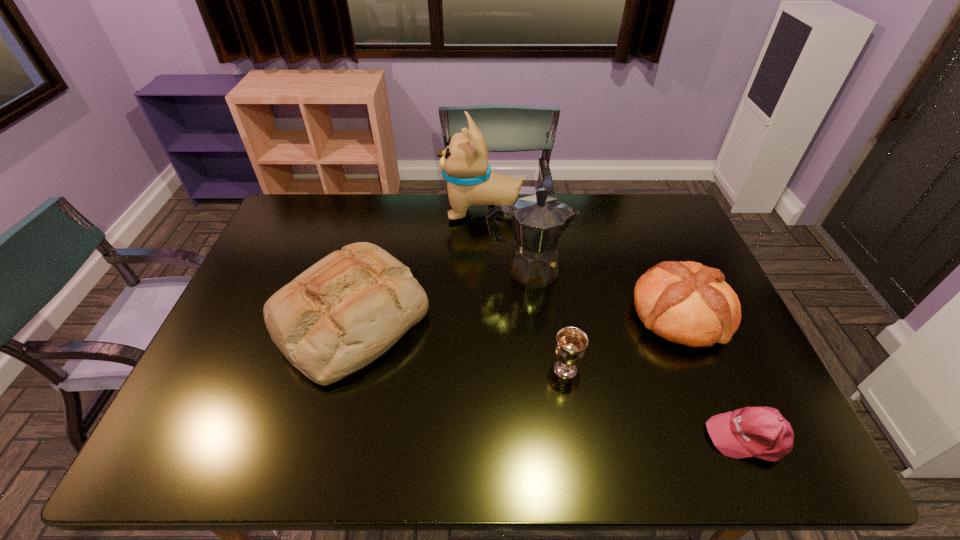
The image size is (960, 540). Find the location of `empty location between the baseball cap and the right bread`. empty location between the baseball cap and the right bread is located at coordinates (714, 376).

The image size is (960, 540). Identify the location of free space between the shortest object and the farthest object. (614, 323).

Find the location of `empty space between the leftmost object and the right bread`. empty space between the leftmost object and the right bread is located at coordinates (516, 316).

Where is `free space between the chalice and the coffeepot`? This screenshot has width=960, height=540. free space between the chalice and the coffeepot is located at coordinates (546, 320).

Where is `free space between the farthest object and the baseball cap`? This screenshot has width=960, height=540. free space between the farthest object and the baseball cap is located at coordinates (614, 323).

Find the location of `vacant area that lies between the puppy and the shorter bread`. vacant area that lies between the puppy and the shorter bread is located at coordinates (581, 262).

You are a GUI agent. You are given a task and a screenshot of the screen. Output one action in this format:
    pyautogui.click(x=<x>, y=<y>)
    Task: Click on the object that stands as the second closest to the coffeepot
    Image resolution: width=960 pixels, height=540 pixels.
    Given the screenshot: What is the action you would take?
    pyautogui.click(x=687, y=303)

The image size is (960, 540). I want to click on object that stands as the closest to the coffeepot, so click(464, 163).

Image resolution: width=960 pixels, height=540 pixels. In order to click on vacant region that satisfies the following two spatial constraints: 1. on the face of the farthest object; 2. on the right side of the right bread in this screenshot , I will do `click(482, 314)`.

Find the location of a particular element. free space that satisfies the following two spatial constraints: 1. on the back side of the shorter bread; 2. on the face of the farthest object is located at coordinates (x=636, y=210).